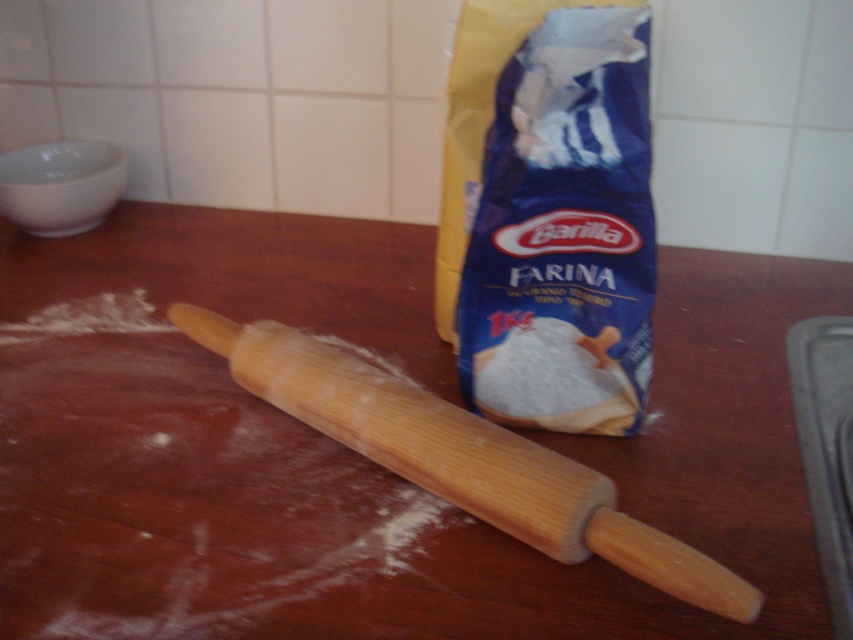
Question: Does blue paper bag at upper right lie behind wooden rolling pin at center?

Choices:
 (A) yes
 (B) no

Answer: (A)

Question: Which point is closer to the camera taking this photo?

Choices:
 (A) (587, 164)
 (B) (345, 397)
 (C) (404, 518)

Answer: (A)

Question: Does blue paper bag at upper right lie in front of wooden rolling pin at center?

Choices:
 (A) yes
 (B) no

Answer: (B)

Question: Which object is positioned closest to the white powder at rolling pin left?

Choices:
 (A) blue paper bag at upper right
 (B) wooden rolling pin at center

Answer: (B)

Question: Is white powder at rolling pin left wider than blue paper bag at upper right?

Choices:
 (A) no
 (B) yes

Answer: (B)

Question: Which of these objects is positioned closest to the wooden rolling pin at center?

Choices:
 (A) white powder at rolling pin left
 (B) blue paper bag at upper right

Answer: (A)